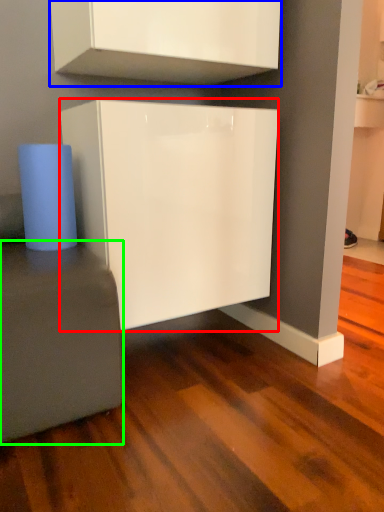
Question: Which object is the closest to the cabinetry (highlighted by a red box)? Choose among these: cabinetry (highlighted by a blue box) or furniture (highlighted by a green box).

Choices:
 (A) cabinetry
 (B) furniture

Answer: (B)